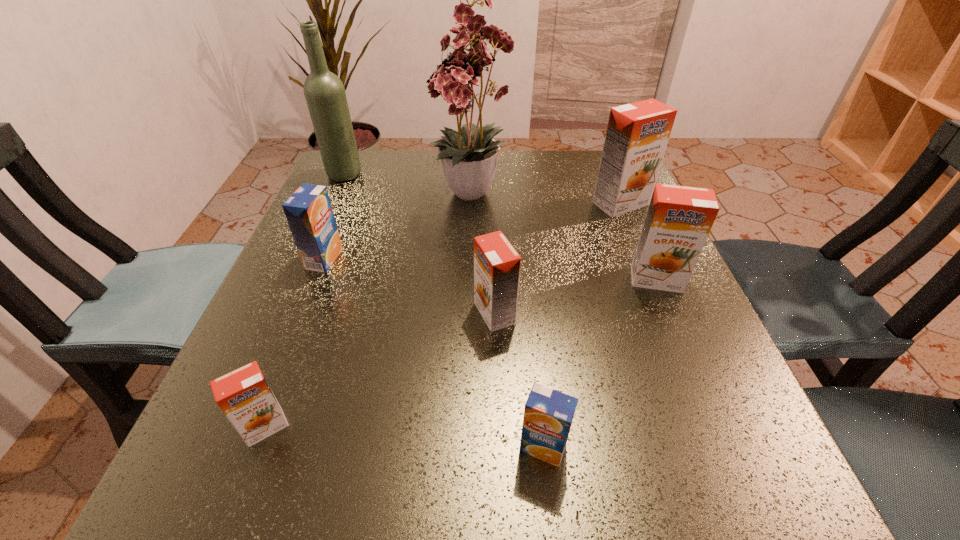
The height and width of the screenshot is (540, 960). What are the coordinates of `object that is positioned at the far right corner` in the screenshot? It's located at (637, 135).

Locate an element on the screen. vacant point at the far edge is located at coordinates (427, 155).

Where is `vacant region at the left edge of the desktop`? This screenshot has width=960, height=540. vacant region at the left edge of the desktop is located at coordinates (344, 202).

What are the coordinates of `vacant space at the right edge of the desktop` in the screenshot? It's located at (624, 261).

In the image, there is a desktop. Identify the location of free space at the near left corner. (260, 505).

The height and width of the screenshot is (540, 960). In the image, there is a desktop. Identify the location of vacant space at the far right corner. (587, 154).

You are a GUI agent. You are given a task and a screenshot of the screen. Output one action in this format:
    pyautogui.click(x=<x>, y=<y>)
    Task: Click on the free space at the near right corner of the desktop
    The height and width of the screenshot is (540, 960).
    Given the screenshot: What is the action you would take?
    pyautogui.click(x=749, y=495)

Identify the location of free space between the left blue orange_juice and the wine bottle. The width and height of the screenshot is (960, 540). (334, 217).

This screenshot has height=540, width=960. I want to click on free space between the nearest orange orange juice and the wine bottle, so click(305, 301).

Find the location of a particular element. This screenshot has width=960, height=540. free space between the farthest orange juice and the farther blue orange_juice is located at coordinates (472, 231).